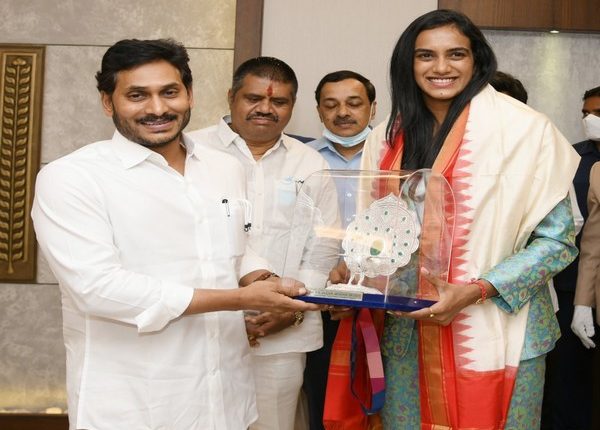
This screenshot has height=430, width=600. In order to click on shelf in this screenshot , I will do `click(511, 2)`, `click(567, 11)`.